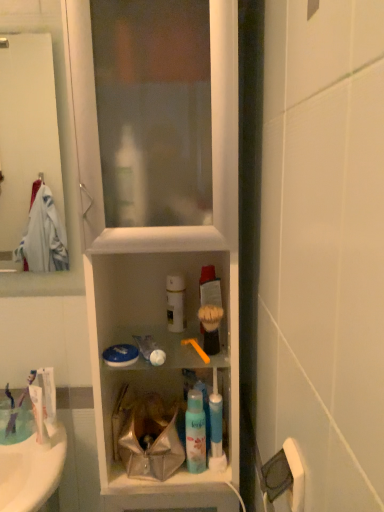
What is the approximate height of white plastic cabinet at center?

white plastic cabinet at center is 4.43 feet tall.

This screenshot has height=512, width=384. What are the coordinates of `white plastic cabinet at center` in the screenshot? It's located at (158, 220).

The height and width of the screenshot is (512, 384). In order to click on white matte toothpaste at lower left, which appears as the second toothpaste when viewed from the back in this screenshot , I will do `click(39, 415)`.

Measure the distance between white glossy tube at left, which is counted as the second toothpaste, starting from the front, and camera.

A distance of 3.64 feet exists between white glossy tube at left, which is counted as the second toothpaste, starting from the front, and camera.

Identify the location of white matte spray can at center. (175, 303).

From a real-world perspective, is white matte spray can at center located beneath translucent plastic mouthwash at center?

No, from a real-world perspective, white matte spray can at center is not under translucent plastic mouthwash at center.

Who is shorter, white matte spray can at center or translucent plastic mouthwash at center?

white matte spray can at center is shorter.

Is point (167, 312) behind point (195, 459)?

Yes, point (167, 312) is farther from viewer.

Can you confirm if white matte spray can at center is bigger than translucent plastic mouthwash at center?

Correct, white matte spray can at center is larger in size than translucent plastic mouthwash at center.

Is point (166, 298) closer or farther from the camera than point (163, 63)?

Clearly, point (166, 298) is more distant from the camera than point (163, 63).

Looking at their sizes, would you say white matte spray can at center is wider or thinner than white plastic cabinet at center?

white matte spray can at center is thinner than white plastic cabinet at center.

Is white matte spray can at center oriented away from white plastic cabinet at center?

Yes, white matte spray can at center's orientation is away from white plastic cabinet at center.

Who is more distant, white matte spray can at center or white matte toothpaste at lower left, which appears as the second toothpaste when viewed from the back?

white matte spray can at center is more distant.

I want to click on toothpaste that is the 2nd object directly below the white matte spray can at center (from a real-world perspective), so click(x=39, y=415).

Consider the image. Can you confirm if white matte spray can at center is bigger than white matte toothpaste at lower left, which appears as the second toothpaste when viewed from the back?

Yes, white matte spray can at center is bigger than white matte toothpaste at lower left, which appears as the second toothpaste when viewed from the back.

Is point (177, 278) closer or farther from the camera than point (35, 405)?

Clearly, point (177, 278) is closer to the camera than point (35, 405).

In terms of height, does white plastic cabinet at center look taller or shorter compared to translucent plastic mouthwash at center?

Considering their sizes, white plastic cabinet at center has more height than translucent plastic mouthwash at center.

Is white plastic cabinet at center located outside translucent plastic mouthwash at center?

Absolutely, white plastic cabinet at center is external to translucent plastic mouthwash at center.

What's the angular difference between white plastic cabinet at center and translucent plastic mouthwash at center's facing directions?

The angular difference between white plastic cabinet at center and translucent plastic mouthwash at center is 0.205 degrees.

Which is less distant, (232, 218) or (190, 413)?

The point (232, 218) is in front.

Is there a large distance between white glossy towel at upper left and white matte toothpaste at lower left, the 1th toothpaste when ordered from front to back?

white glossy towel at upper left is far away from white matte toothpaste at lower left, the 1th toothpaste when ordered from front to back.

How far apart are white glossy towel at upper left and white matte toothpaste at lower left, which appears as the second toothpaste when viewed from the back?

white glossy towel at upper left is 2.07 meters away from white matte toothpaste at lower left, which appears as the second toothpaste when viewed from the back.

Could white matte toothpaste at lower left, the 1th toothpaste when ordered from front to back, be considered to be inside white glossy towel at upper left?

No, white glossy towel at upper left does not contain white matte toothpaste at lower left, the 1th toothpaste when ordered from front to back.

Is white glossy towel at upper left turned away from white matte toothpaste at lower left, which appears as the second toothpaste when viewed from the back?

No, white glossy towel at upper left is not facing away from white matte toothpaste at lower left, which appears as the second toothpaste when viewed from the back.

Is white plastic cabinet at center positioned with its back to white matte toothpaste at lower left, which appears as the second toothpaste when viewed from the back?

No, white plastic cabinet at center's orientation is not away from white matte toothpaste at lower left, which appears as the second toothpaste when viewed from the back.

Can you see white plastic cabinet at center touching white matte toothpaste at lower left, the 1th toothpaste when ordered from front to back?

white plastic cabinet at center is not next to white matte toothpaste at lower left, the 1th toothpaste when ordered from front to back, and they're not touching.

Is white plastic cabinet at center to the left of white matte toothpaste at lower left, which appears as the second toothpaste when viewed from the back, from the viewer's perspective?

In fact, white plastic cabinet at center is to the right of white matte toothpaste at lower left, which appears as the second toothpaste when viewed from the back.

Which is nearer, (178, 259) or (39, 414)?

Clearly, point (178, 259) is more distant from the camera than point (39, 414).

Between white plastic cabinet at center and white matte spray can at center, which one has more height?

Standing taller between the two is white plastic cabinet at center.

Measure the distance from white plastic cabinet at center to white matte spray can at center.

white plastic cabinet at center is 10.15 inches from white matte spray can at center.

Based on their sizes in the image, would you say white plastic cabinet at center is bigger or smaller than white matte spray can at center?

white plastic cabinet at center is bigger than white matte spray can at center.

Between point (142, 128) and point (172, 288), which one is positioned behind?

The point (172, 288) is farther.

You are a GUI agent. You are given a task and a screenshot of the screen. Output one action in this format:
    pyautogui.click(x=<x>, y=<y>)
    Task: Click on the cleaning product behind the translucent plastic mouthwash at center
    
    Given the screenshot: What is the action you would take?
    pyautogui.click(x=175, y=303)

The image size is (384, 512). Find the location of `cleaning product that is above the white plastic cabinet at center (from the image's perspective)`. cleaning product that is above the white plastic cabinet at center (from the image's perspective) is located at coordinates (175, 303).

Which object lies further to the anchor point translucent plastic mouthwash at center, white plastic cabinet at center or white matte spray can at center?

white plastic cabinet at center is positioned further to the anchor translucent plastic mouthwash at center.

Looking at the image, which one is located further to white plastic cabinet at center, white matte spray can at center or white matte toothpaste at lower left, the 1th toothpaste when ordered from front to back?

white matte toothpaste at lower left, the 1th toothpaste when ordered from front to back, is further to white plastic cabinet at center.

When comparing their distances from orange plastic toothbrush at center, does white glossy towel at upper left or white glossy tube at left, positioned as the 1th toothpaste in back-to-front order, seem further?

Among the two, white glossy towel at upper left is located further to orange plastic toothbrush at center.

From the image, which object appears to be nearer to white glossy tube at left, which is counted as the second toothpaste, starting from the front, translucent plastic mouthwash at center or orange plastic toothbrush at center?

The object closer to white glossy tube at left, which is counted as the second toothpaste, starting from the front, is orange plastic toothbrush at center.

Which object lies further to the anchor point white matte toothpaste at lower left, the 1th toothpaste when ordered from front to back, orange plastic toothbrush at center or translucent plastic mouthwash at center?

The object further to white matte toothpaste at lower left, the 1th toothpaste when ordered from front to back, is orange plastic toothbrush at center.

Looking at the image, which one is located closer to white plastic cabinet at center, translucent plastic mouthwash at center or white matte toothpaste at lower left, which appears as the second toothpaste when viewed from the back?

Among the two, translucent plastic mouthwash at center is located nearer to white plastic cabinet at center.

When comparing their distances from white plastic cabinet at center, does white matte toothpaste at lower left, which appears as the second toothpaste when viewed from the back, or translucent plastic mouthwash at center seem further?

white matte toothpaste at lower left, which appears as the second toothpaste when viewed from the back, is positioned further to the anchor white plastic cabinet at center.

Considering their positions, is translucent plastic mouthwash at center positioned closer to white glossy tube at left, which is counted as the second toothpaste, starting from the front, than white plastic cabinet at center?

The object closer to white glossy tube at left, which is counted as the second toothpaste, starting from the front, is translucent plastic mouthwash at center.

Where is `toothpaste positioned between white plastic cabinet at center and white glossy tube at left, which is counted as the second toothpaste, starting from the front, from near to far`? The width and height of the screenshot is (384, 512). toothpaste positioned between white plastic cabinet at center and white glossy tube at left, which is counted as the second toothpaste, starting from the front, from near to far is located at coordinates (39, 415).

Image resolution: width=384 pixels, height=512 pixels. Find the location of `brush between white glossy towel at upper left and white matte toothpaste at lower left, which appears as the second toothpaste when viewed from the back, vertically`. brush between white glossy towel at upper left and white matte toothpaste at lower left, which appears as the second toothpaste when viewed from the back, vertically is located at coordinates (196, 348).

This screenshot has height=512, width=384. In order to click on cleaning product between white glossy towel at upper left and white matte toothpaste at lower left, which appears as the second toothpaste when viewed from the back, vertically in this screenshot , I will do `click(175, 303)`.

Locate an element on the screen. The image size is (384, 512). mouthwash located between white plastic cabinet at center and white matte spray can at center in the depth direction is located at coordinates (195, 432).